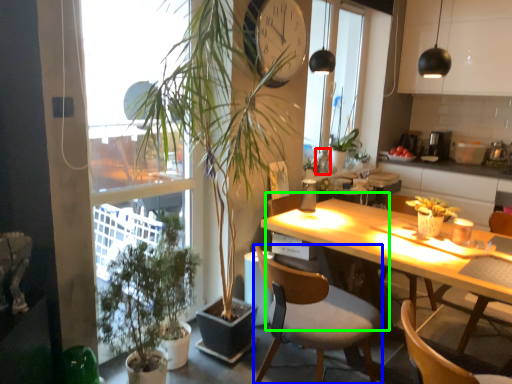
Question: Which object is the farthest from bottle (highlighted by a red box)? Choose among these: chair (highlighted by a blue box) or chair (highlighted by a green box).

Choices:
 (A) chair
 (B) chair

Answer: (A)